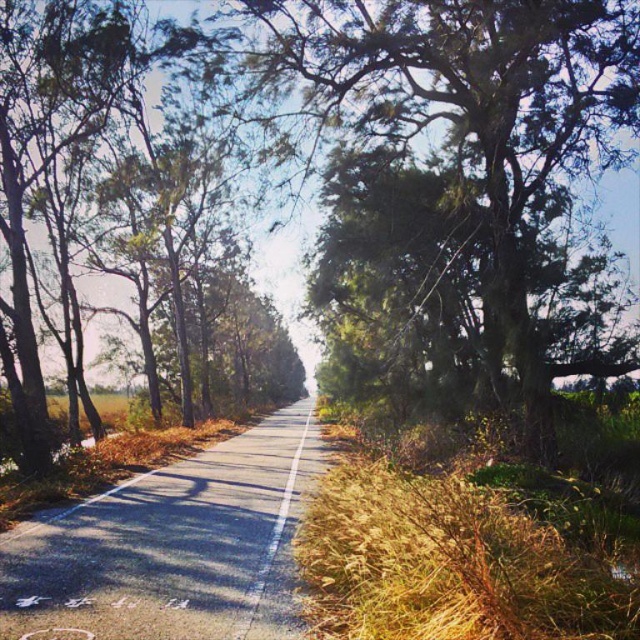
You are a hiker who wants to cross the road quickly. You notice dry grass at right and green leafy tree at left. Which object would you choose to step over if you want to minimize the height you need to climb?

The dry grass at right has a lesser height compared to the green leafy tree at left, so stepping over the dry grass at right would require less climbing effort.

You are a hiker walking along the road and want to take a photo of the green mossy tree at center and the green leafy tree at left. Which tree should you move closer to in order to capture both trees in the same frame without any obstruction?

You should move closer to the green mossy tree at center because it is in front of the green leafy tree at left, allowing both to be visible in the frame without obstruction.

You are a hiker trying to cross the road shown in the image. You notice the green mossy tree at center and the dry grass at right. Which of these two objects is bigger in size?

The green mossy tree at center is larger in size than the dry grass at right.